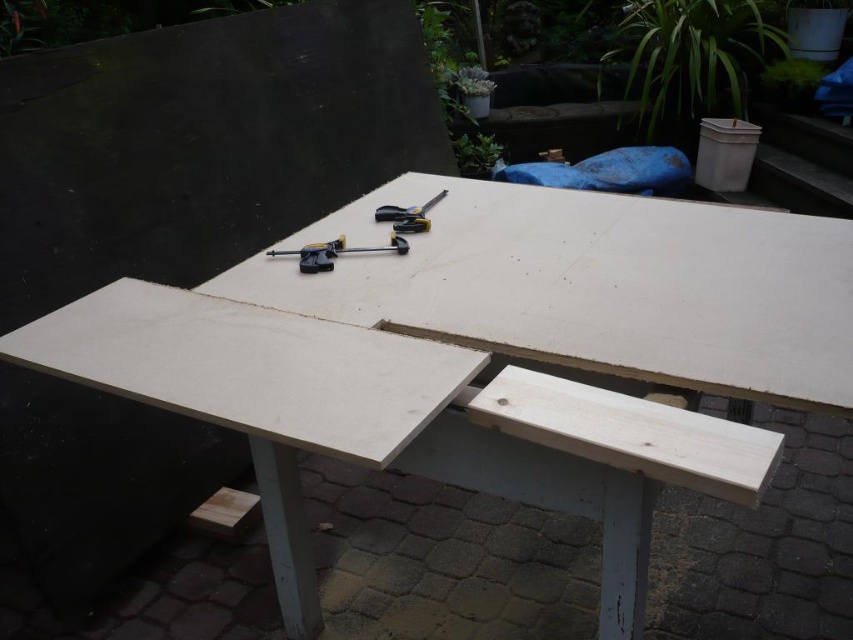
Question: Can you confirm if natural wood picnic table at center is positioned to the right of black plastic tool at center?

Choices:
 (A) no
 (B) yes

Answer: (B)

Question: Does natural wood picnic table at center come in front of black plastic tool at center?

Choices:
 (A) yes
 (B) no

Answer: (A)

Question: Can you confirm if natural wood picnic table at center is positioned above metallic silver pliers at center?

Choices:
 (A) no
 (B) yes

Answer: (A)

Question: Which of the following is the closest to the observer?

Choices:
 (A) (399, 221)
 (B) (633, 250)
 (C) (395, 240)

Answer: (B)

Question: Which point appears closest to the camera in this image?

Choices:
 (A) (109, 392)
 (B) (438, 198)
 (C) (374, 248)

Answer: (A)

Question: Which of the following is the closest to the observer?

Choices:
 (A) (318, 266)
 (B) (498, 349)
 (C) (440, 193)

Answer: (B)